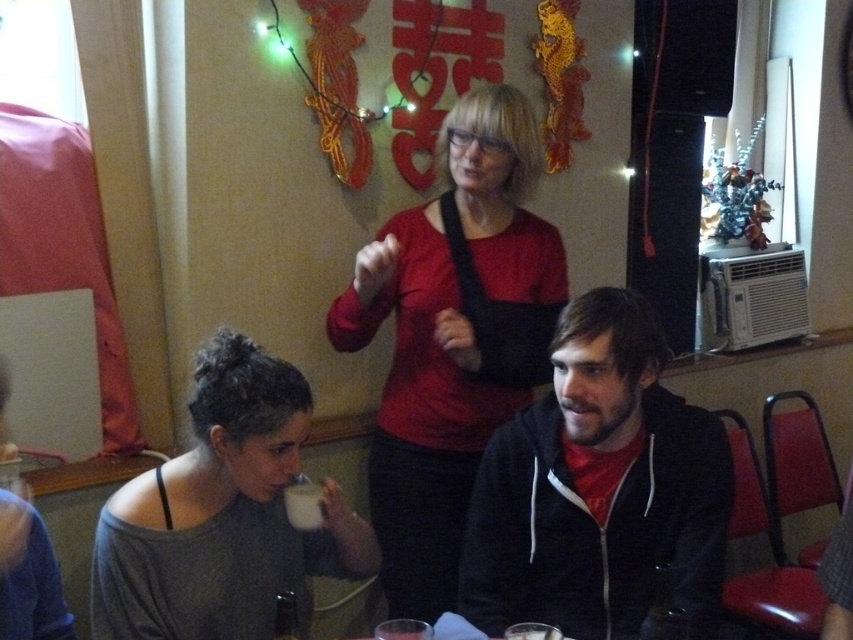
You are a waiter in a restaurant and need to place a new order of drinks on the table. The table has a white glossy mug at lower center. Where should you place the new drinks to avoid knocking over the existing mug?

Place the new drinks away from the coordinates point (303, 502) where the white glossy mug at lower center is located to avoid knocking it over.

You are a barista in a restaurant and you need to serve two customers. You have a white glossy mug at lower center and a white matte cup at lower center. Which one can hold more liquid?

The white glossy mug at lower center can hold more liquid because it has a larger size compared to the white matte cup at lower center.

You are a waiter in a restaurant and need to deliver a drink to the customer. The customer is wearing the matte red shirt at center and is sitting above the white matte cup at lower center. Where should you place the new drink to ensure it is near the existing cup without being directly on top of it?

The matte red shirt at center is located above the white matte cup at lower center, so you should place the new drink near the white matte cup at lower center but slightly below it to avoid being directly on top.